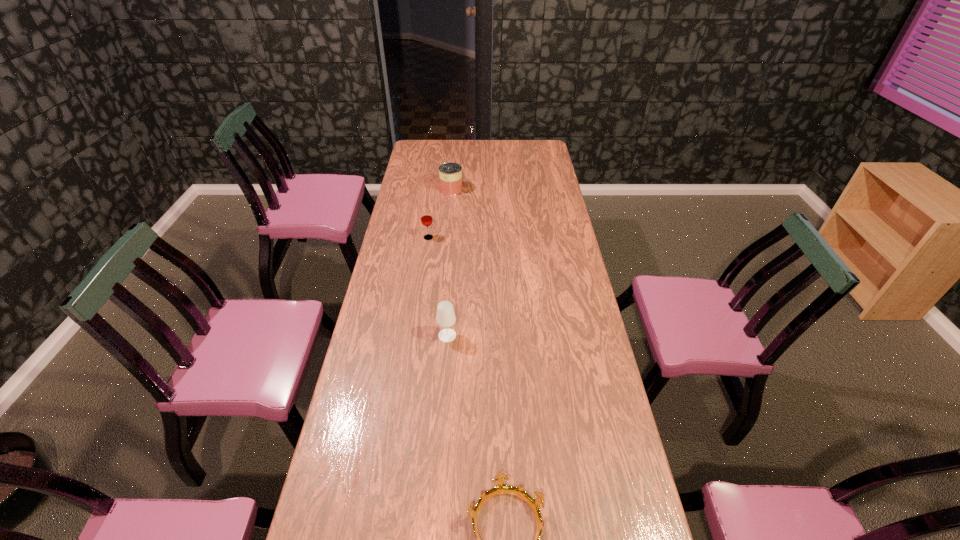
Find the location of `vacant space at the left edge`. vacant space at the left edge is located at coordinates (389, 305).

You are a GUI agent. You are given a task and a screenshot of the screen. Output one action in this format:
    pyautogui.click(x=<x>, y=<y>)
    Task: Click on the vacant space at the right edge of the desktop
    The image size is (960, 540).
    Given the screenshot: What is the action you would take?
    pyautogui.click(x=559, y=272)

In order to click on vacant space at the far left corner of the desktop in this screenshot , I will do `click(420, 148)`.

Where is `empty location between the farthest object and the farther glass`? empty location between the farthest object and the farther glass is located at coordinates coord(440,214).

Identify the location of free space between the farther glass and the right glass. The height and width of the screenshot is (540, 960). (438, 287).

At what (x,y) coordinates should I click in order to perform the action: click on free space between the farther glass and the can. Please return your answer as a coordinate pair (x, y). The image size is (960, 540). Looking at the image, I should click on (440, 214).

Identify the location of vacant point located between the left glass and the second nearest object. (438, 287).

Locate an element on the screen. free point between the farthest object and the third nearest object is located at coordinates (440, 214).

Identify the location of the second closest object to the second farthest object. (445, 318).

Point out which object is positioned as the second nearest to the second nearest object. Please provide its 2D coordinates. Your answer should be formatted as a tuple, i.e. [(x, y)], where the tuple contains the x and y coordinates of a point satisfying the conditions above.

[(426, 217)]